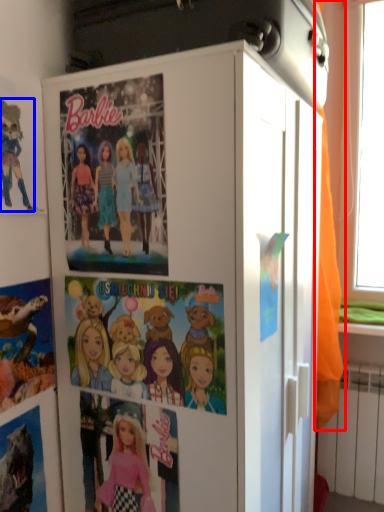
Question: Which object is further to the camera taking this photo, curtain (highlighted by a red box) or cartoon (highlighted by a blue box)?

Choices:
 (A) curtain
 (B) cartoon

Answer: (A)